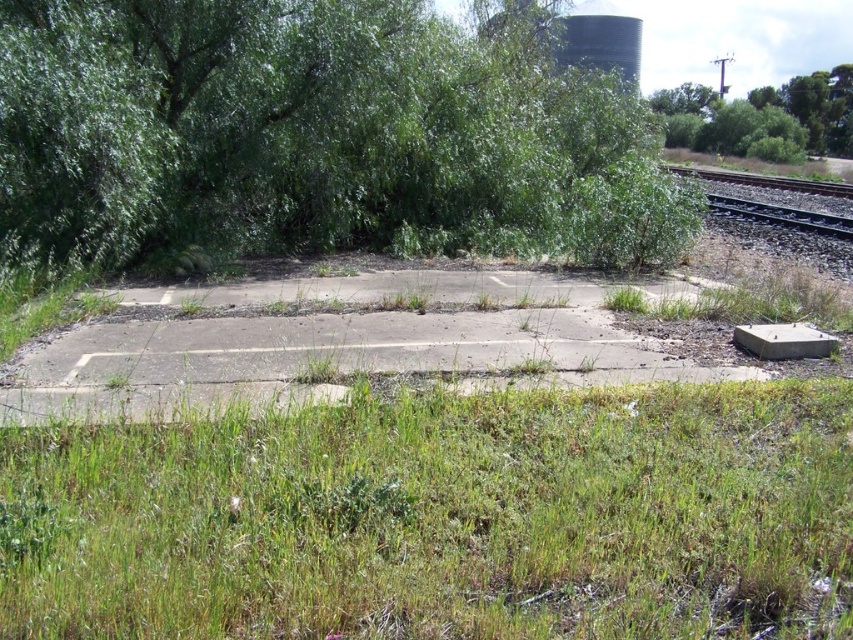
You are standing at the point labeled as point [440,518] in the image. Based on the scene description, what type of terrain are you currently standing on?

The point [440,518] is on green grass at lower center, so you are standing on green grass.

You are standing at the base of the green leafy tree at upper left. You want to throw a ball to your friend who is standing 30 feet away from you. Will your friend be able to catch the ball if they are standing in the middle of the concrete platform?

The distance between you and your friend is 30 feet, but the green leafy tree at upper left and the viewer are 28.76 feet apart. Therefore, your friend is slightly farther away than the tree, so the ball might not reach them unless thrown with enough force.

You are standing at the origin point of the coordinate system in the image. You want to walk to the green grass at lower center. What are the coordinates you need to move to?

The coordinates to move to are 0.811 in the x direction and 0.518 in the y direction.